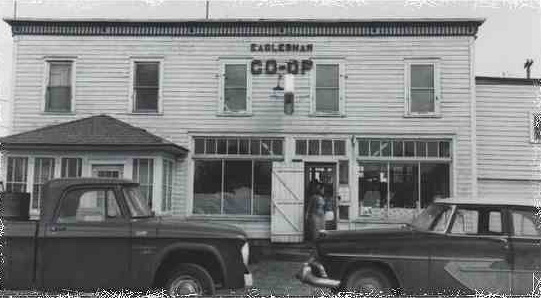
I want to click on handle, so click(x=58, y=229).